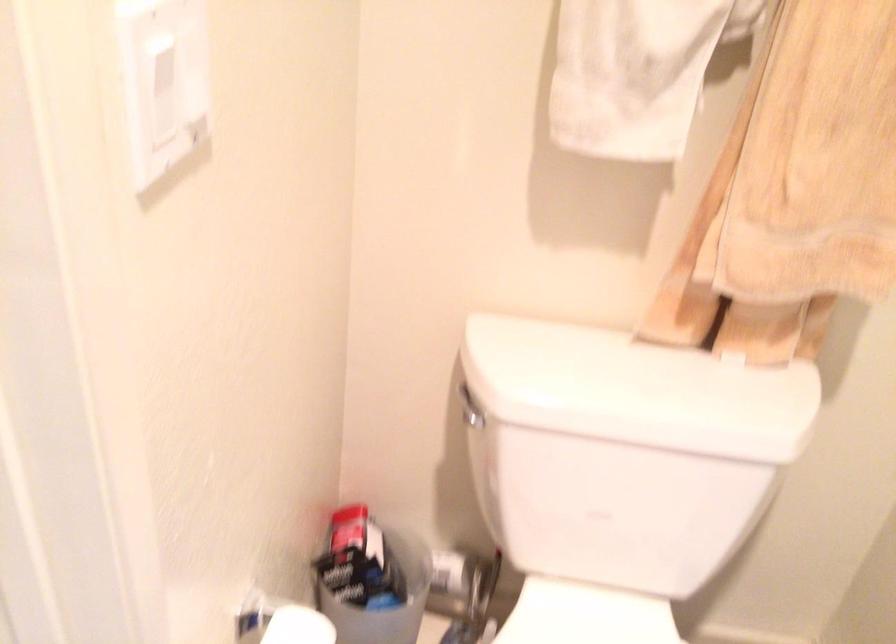
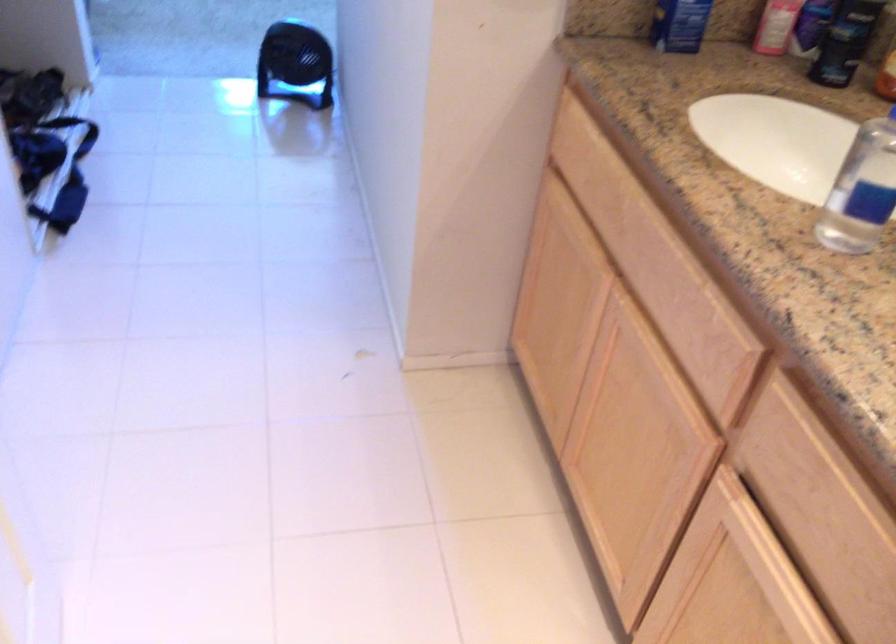
The first image is from the beginning of the video and the second image is from the end. How did the camera likely rotate when shooting the video?

The rotation direction of the camera is left-down.